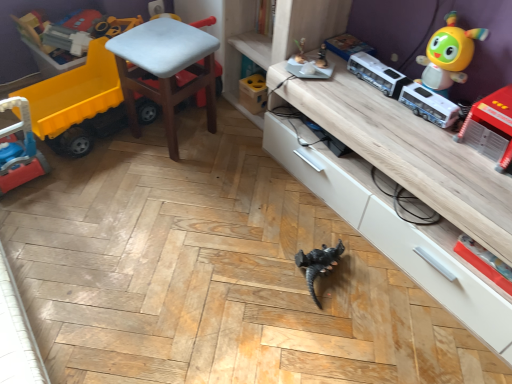
At what (x,y) coordinates should I click in order to perform the action: click on vacant region in front of wooden block at center, placed as the 2th toy when sorted from left to right. Please return your answer as a coordinate pair (x, y). Looking at the image, I should click on (242, 125).